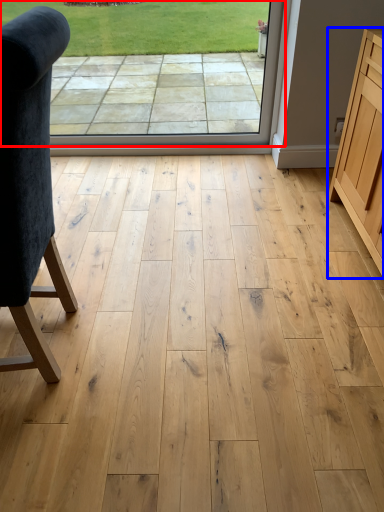
Question: Among these objects, which one is farthest to the camera, window screen (highlighted by a red box) or cabinetry (highlighted by a blue box)?

Choices:
 (A) window screen
 (B) cabinetry

Answer: (A)